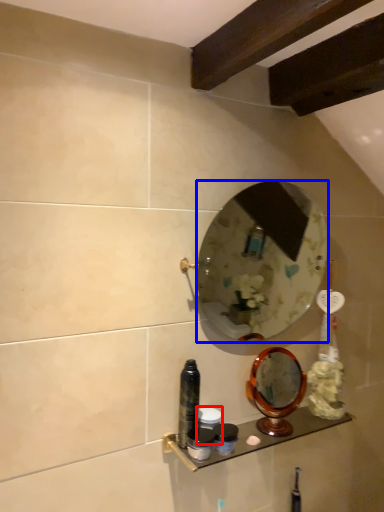
Question: Which object appears farthest to the camera in this image, toiletry (highlighted by a red box) or mirror (highlighted by a blue box)?

Choices:
 (A) toiletry
 (B) mirror

Answer: (A)